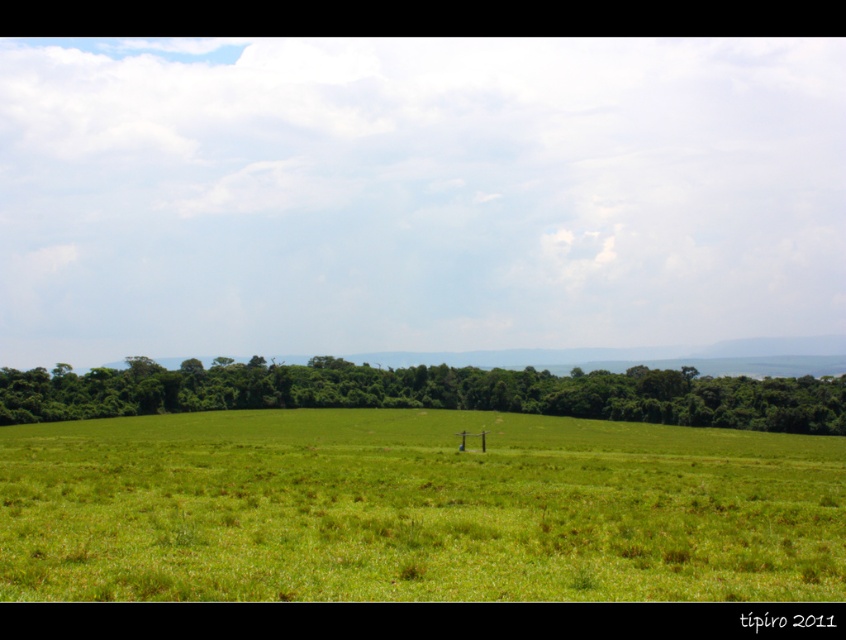
Which is more to the left, green grassy pasture at center or green leafy trees at center?

From the viewer's perspective, green grassy pasture at center appears more on the left side.

Is green grassy pasture at center below green leafy trees at center?

Actually, green grassy pasture at center is above green leafy trees at center.

At what (x,y) coordinates should I click in order to perform the action: click on green grassy pasture at center. Please return your answer as a coordinate pair (x, y). Image resolution: width=846 pixels, height=640 pixels. Looking at the image, I should click on (415, 509).

You are a GUI agent. You are given a task and a screenshot of the screen. Output one action in this format:
    pyautogui.click(x=<x>, y=<y>)
    Task: Click on the green grassy pasture at center
    Image resolution: width=846 pixels, height=640 pixels.
    Given the screenshot: What is the action you would take?
    pyautogui.click(x=415, y=509)